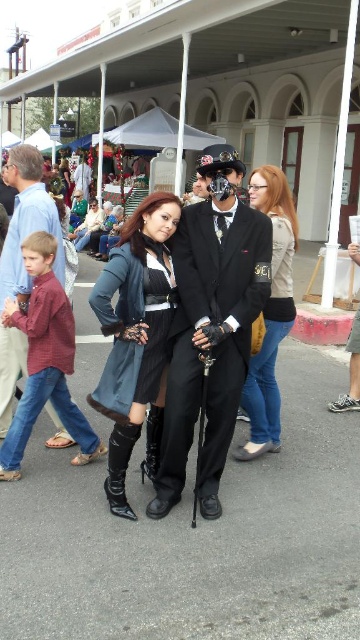
Question: Does matte black jacket at center come behind matte black suit at center?

Choices:
 (A) yes
 (B) no

Answer: (B)

Question: Which point is farther from the camera taking this photo?

Choices:
 (A) (87, 164)
 (B) (198, 314)
 (C) (51, 355)

Answer: (A)

Question: Where is matte black coat at center located in relation to matte black suit at center in the image?

Choices:
 (A) right
 (B) left

Answer: (A)

Question: Which object is closer to the camera taking this photo?

Choices:
 (A) dark gray fabric dress at center
 (B) black satin dress at center

Answer: (A)

Question: Considering the real-world distances, which object is farthest from the maroon cotton shirt at left?

Choices:
 (A) matte black suit at center
 (B) matte black jacket at center
 (C) dark gray fabric dress at center
 (D) shiny black suit at center

Answer: (A)

Question: Can you confirm if shiny black suit at center is smaller than dark gray fabric dress at center?

Choices:
 (A) no
 (B) yes

Answer: (A)